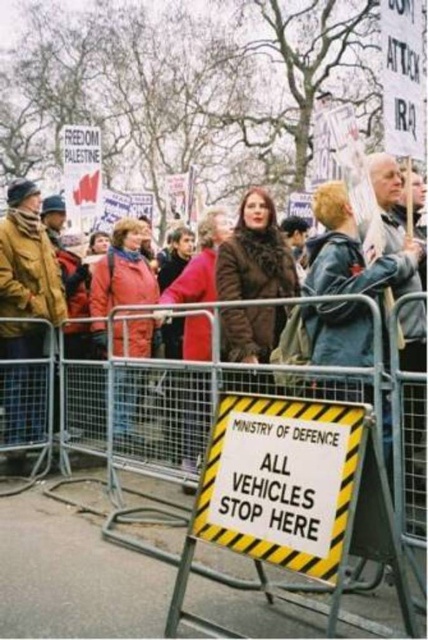
Consider the image. Who is taller, metallic silver fence at center or red jacket at center?

With more height is red jacket at center.

How far apart are metallic silver fence at center and red jacket at center?

1.50 meters

Is point (416, 506) closer to camera compared to point (115, 422)?

Yes, it is in front of point (115, 422).

Image resolution: width=428 pixels, height=640 pixels. What are the coordinates of `metallic silver fence at center` in the screenshot? It's located at (139, 397).

Does yellow/black striped sign at center have a greater width compared to red jacket at center?

No, yellow/black striped sign at center is not wider than red jacket at center.

Can you confirm if yellow/black striped sign at center is positioned to the left of red jacket at center?

Incorrect, yellow/black striped sign at center is not on the left side of red jacket at center.

I want to click on yellow/black striped sign at center, so pyautogui.click(x=281, y=481).

Does brown leather jacket at left have a smaller size compared to brown fuzzy coat at center?

No.

Image resolution: width=428 pixels, height=640 pixels. What are the coordinates of `brown leather jacket at left` in the screenshot? It's located at (27, 259).